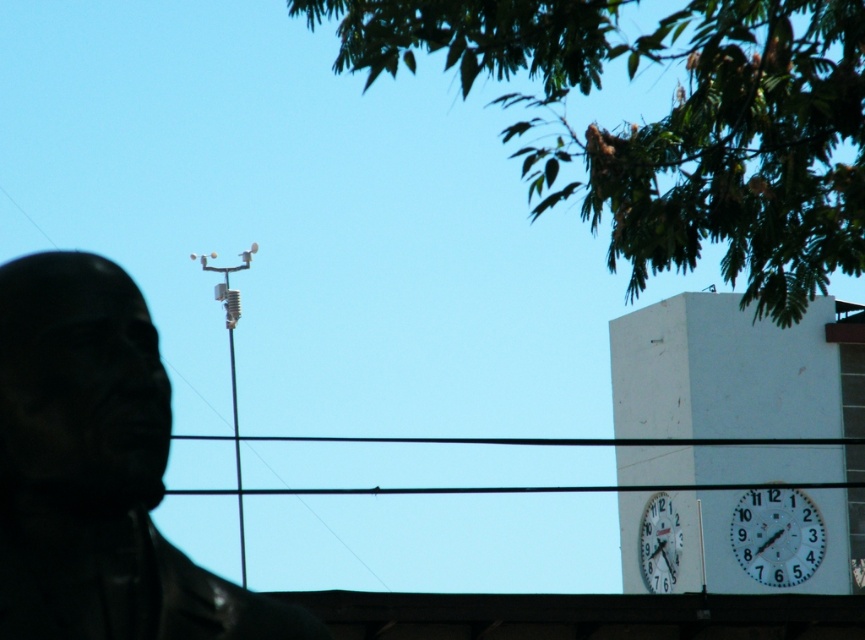
You are standing in the park and see the black matte statue at upper left and the white glossy clock at right. Which object is closer to you?

The black matte statue at upper left is closer to you because it is in front of the white glossy clock at right.

You are a painter setting up an easel to paint the scene. You want to ensure that the green leafy tree at upper center and the black matte statue at upper left are both visible in your painting. Based on their heights, which object should you position closer to the foreground to maintain their visibility?

Since the green leafy tree at upper center is taller than the black matte statue at upper left, to maintain visibility of both in the painting, you should position the black matte statue at upper left closer to the foreground. This way, even though it is shorter, its placement forward will keep it visible alongside the taller tree in the background.

You are an architect designing a new garden layout. You need to place a bench between the black matte statue at upper left and the white glossy clock at right. Considering their heights, which object should the bench be closer to to ensure it doesn

The bench should be placed closer to the white glossy clock at right because the black matte statue at upper left is taller. This arrangement ensures the bench is positioned near the shorter object for better visibility and balance.